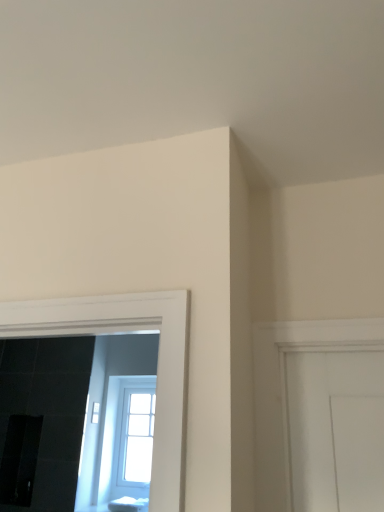
Question: From the image's perspective, relative to white glossy sugar cube at lower center, is clear glass window at center above or below?

Choices:
 (A) below
 (B) above

Answer: (B)

Question: From a real-world perspective, is clear glass window at center positioned above or below white glossy sugar cube at lower center?

Choices:
 (A) below
 (B) above

Answer: (B)

Question: In the image, is clear glass window at center on the left side or the right side of white glossy sugar cube at lower center?

Choices:
 (A) left
 (B) right

Answer: (A)

Question: Is white glossy sugar cube at lower center inside the boundaries of clear glass window at center, or outside?

Choices:
 (A) inside
 (B) outside

Answer: (B)

Question: Considering their positions, is white glossy sugar cube at lower center located in front of or behind clear glass window at center?

Choices:
 (A) front
 (B) behind

Answer: (A)

Question: From the image's perspective, is white glossy sugar cube at lower center above or below clear glass window at center?

Choices:
 (A) above
 (B) below

Answer: (B)

Question: Looking at the image, does white glossy sugar cube at lower center seem bigger or smaller compared to clear glass window at center?

Choices:
 (A) big
 (B) small

Answer: (B)